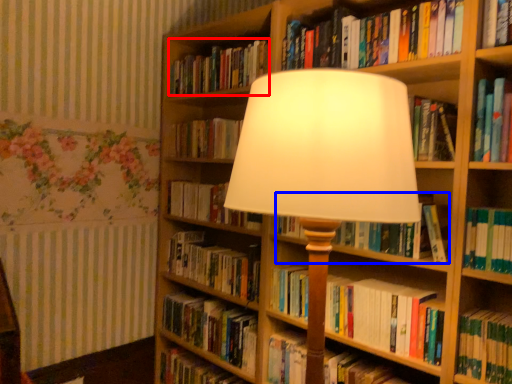
Question: Which object appears farthest to the camera in this image, book (highlighted by a red box) or book (highlighted by a blue box)?

Choices:
 (A) book
 (B) book

Answer: (A)